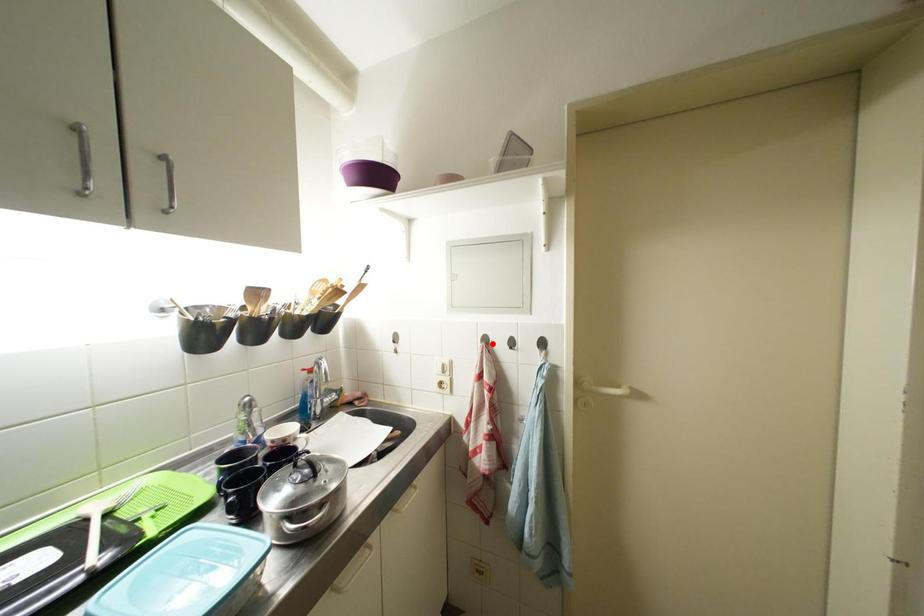
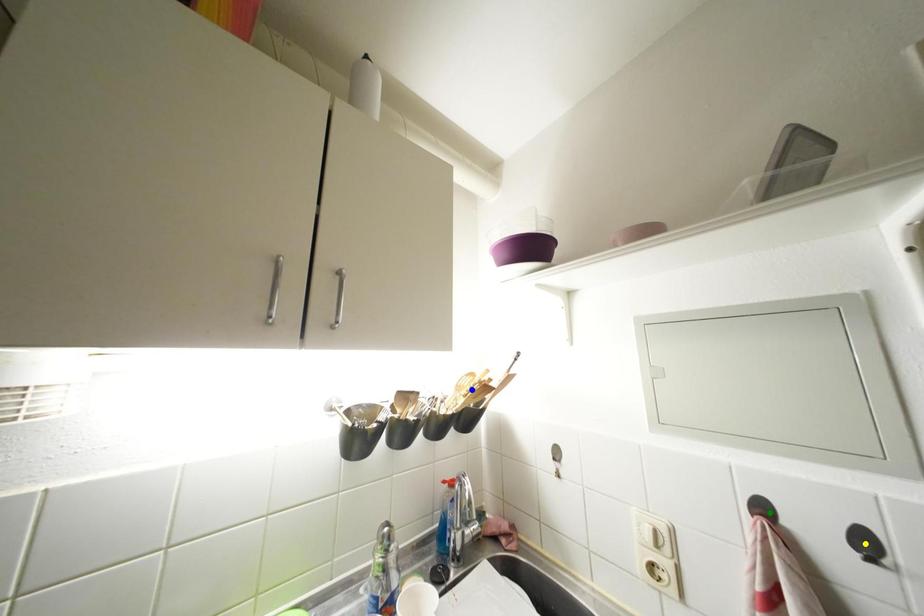
Question: I am providing you with two images of the same scene from different viewpoints. A red point is marked on the first image. You are given multiple points on the second image. Which point in image 2 represents the same 3d spot as the red point in image 1?

Choices:
 (A) blue point
 (B) green point
 (C) yellow point

Answer: (B)